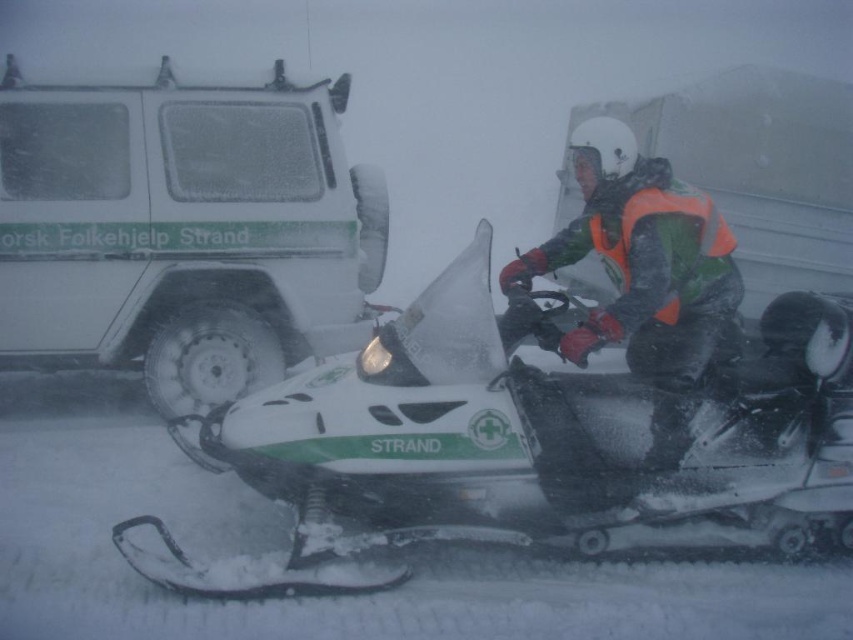
Question: Is white matte snowmobile at center behind white matte van at upper left?

Choices:
 (A) no
 (B) yes

Answer: (A)

Question: Which is nearer to the reflective orange vest at center?

Choices:
 (A) white matte snowmobile at center
 (B) white matte van at upper left

Answer: (A)

Question: Which object appears farthest from the camera in this image?

Choices:
 (A) white matte van at upper left
 (B) reflective orange vest at center

Answer: (A)

Question: Which object appears closest to the camera in this image?

Choices:
 (A) white matte van at upper left
 (B) reflective orange vest at center

Answer: (B)

Question: Does white matte snowmobile at center have a smaller size compared to white matte van at upper left?

Choices:
 (A) no
 (B) yes

Answer: (A)

Question: Considering the relative positions of white matte snowmobile at center and white matte van at upper left in the image provided, where is white matte snowmobile at center located with respect to white matte van at upper left?

Choices:
 (A) left
 (B) right

Answer: (B)